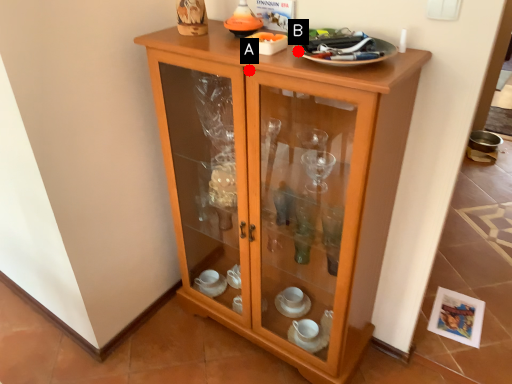
Question: Two points are circled on the image, labeled by A and B beside each circle. Which point is farther from the camera taking this photo?

Choices:
 (A) A is further
 (B) B is further

Answer: (A)